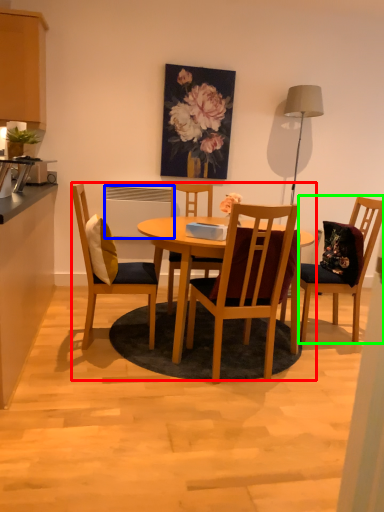
Question: Estimate the real-world distances between objects in this image. Which object is farther from kitchen & dining room table (highlighted by a red box), appliance (highlighted by a blue box) or chair (highlighted by a green box)?

Choices:
 (A) appliance
 (B) chair

Answer: (B)